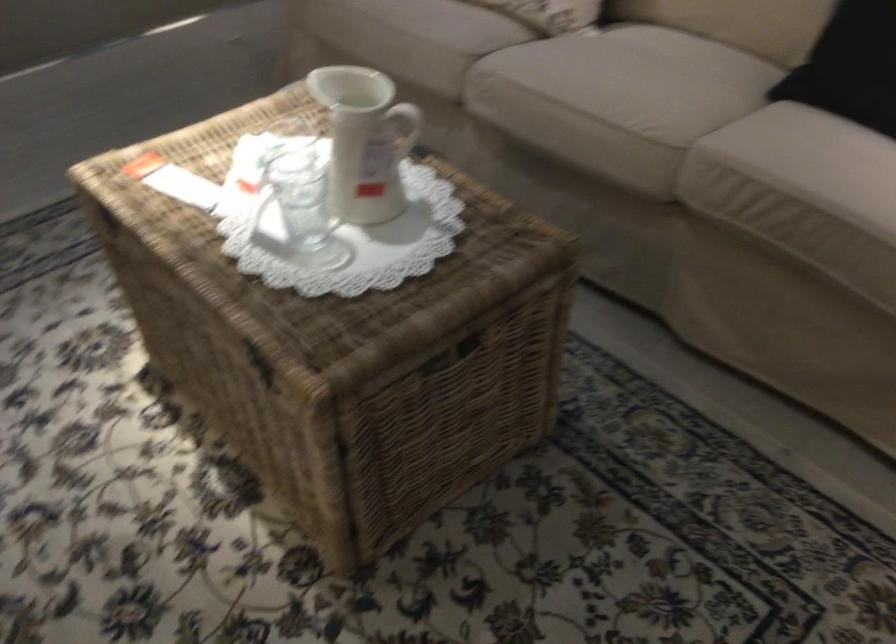
Where would you lift the clear drinking glass? Please return your answer as a coordinate pair (x, y).

(304, 204)